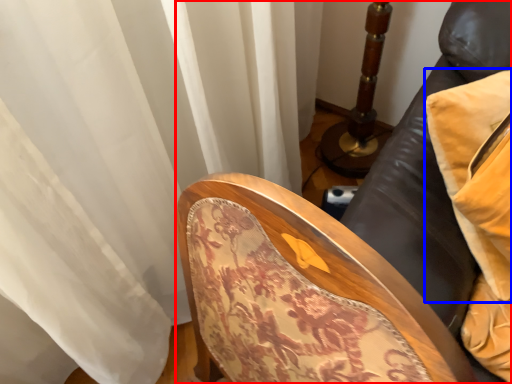
Question: Which of the following is the closest to the observer, furniture (highlighted by a red box) or pillow (highlighted by a blue box)?

Choices:
 (A) furniture
 (B) pillow

Answer: (A)